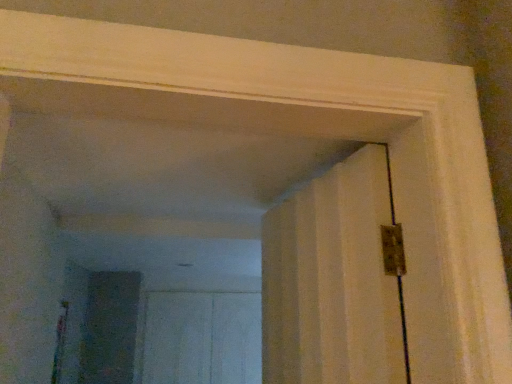
Question: Should I look upward or downward to see white matte door at center?

Choices:
 (A) up
 (B) down

Answer: (B)